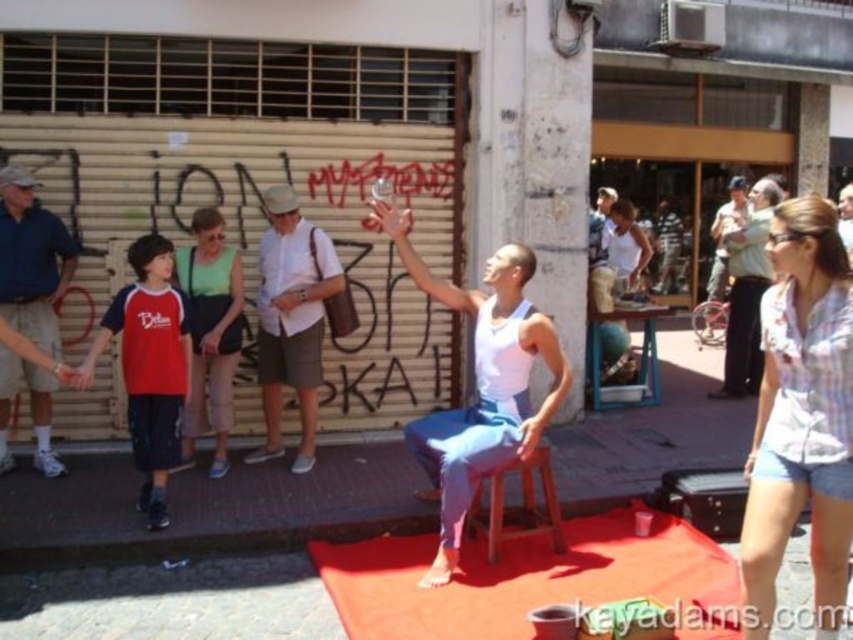
Who is positioned more to the left, plaid shirt at center or red cotton shirt at left?

red cotton shirt at left is more to the left.

Looking at this image, is plaid shirt at center thinner than red cotton shirt at left?

Indeed, plaid shirt at center has a lesser width compared to red cotton shirt at left.

Which is behind, point (814, 512) or point (148, 268)?

Point (148, 268)

Where is `plaid shirt at center`? This screenshot has height=640, width=853. plaid shirt at center is located at coordinates click(x=801, y=413).

Looking at this image, between red cotton shirt at left and blue denim shorts at left, which one is positioned higher?

Positioned higher is blue denim shorts at left.

Between red cotton shirt at left and blue denim shorts at left, which one appears on the right side from the viewer's perspective?

From the viewer's perspective, red cotton shirt at left appears more on the right side.

In order to click on red cotton shirt at left in this screenshot , I will do `click(149, 364)`.

From the picture: Measure the distance between plaid shirt at center and blue denim shorts at left.

plaid shirt at center is 4.87 meters away from blue denim shorts at left.

Is plaid shirt at center positioned behind blue denim shorts at left?

No, plaid shirt at center is in front of blue denim shorts at left.

You are a GUI agent. You are given a task and a screenshot of the screen. Output one action in this format:
    pyautogui.click(x=<x>, y=<y>)
    Task: Click on the plaid shirt at center
    
    Given the screenshot: What is the action you would take?
    pyautogui.click(x=801, y=413)